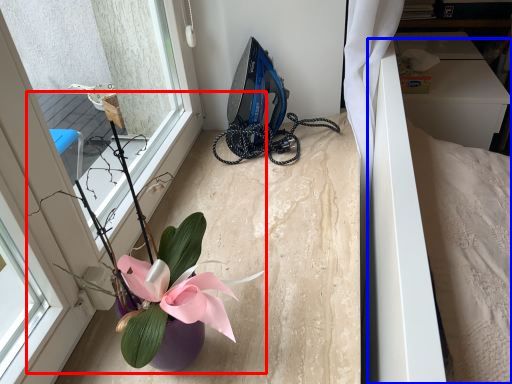
Question: Among these objects, which one is nearest to the camera, houseplant (highlighted by a red box) or bed (highlighted by a blue box)?

Choices:
 (A) houseplant
 (B) bed

Answer: (A)